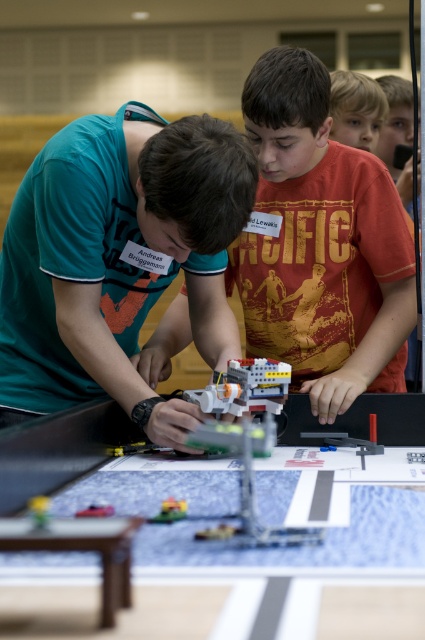
You are a judge at the robotics competition. You need to determine which object is wider between the translucent plastic robot at center and the translucent plastic toy at lower left. Which one is wider?

The translucent plastic robot at center is wider than the translucent plastic toy at lower left.

You are a judge at the robotics competition. You need to determine if the matte green shirt at center is taller than the translucent plastic toy at lower left. Based on the scene description, can you confirm this?

Yes, the matte green shirt at center is taller than the translucent plastic toy at lower left according to the description.

You are standing at the robotics competition and want to know which of the two points, point (x=127, y=291) or point (x=388, y=269), is closer to you. Can you determine this based on the provided information?

Point (x=127, y=291) is closer to the viewer than point (x=388, y=269).